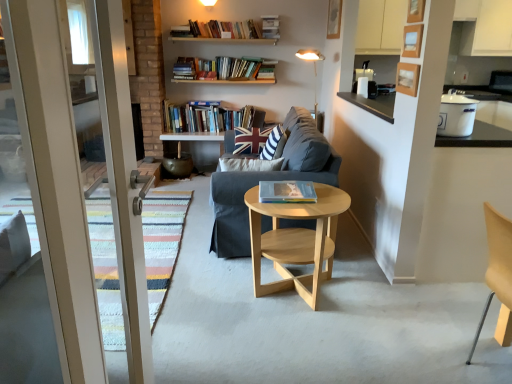
Where is `free space that is to the left of light wood/woodenobject at center`? The image size is (512, 384). free space that is to the left of light wood/woodenobject at center is located at coordinates (207, 293).